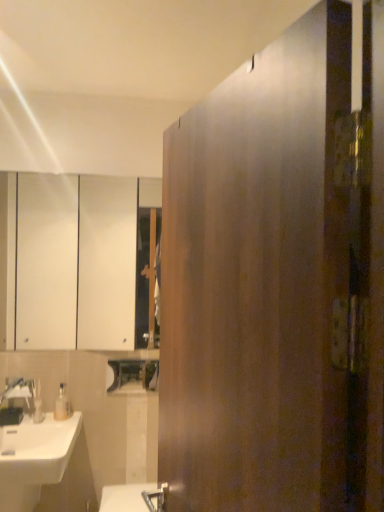
Locate an element on the screen. Image resolution: width=384 pixels, height=512 pixels. vacant area on top of white glossy cabinet at upper left (from a real-world perspective) is located at coordinates (86, 172).